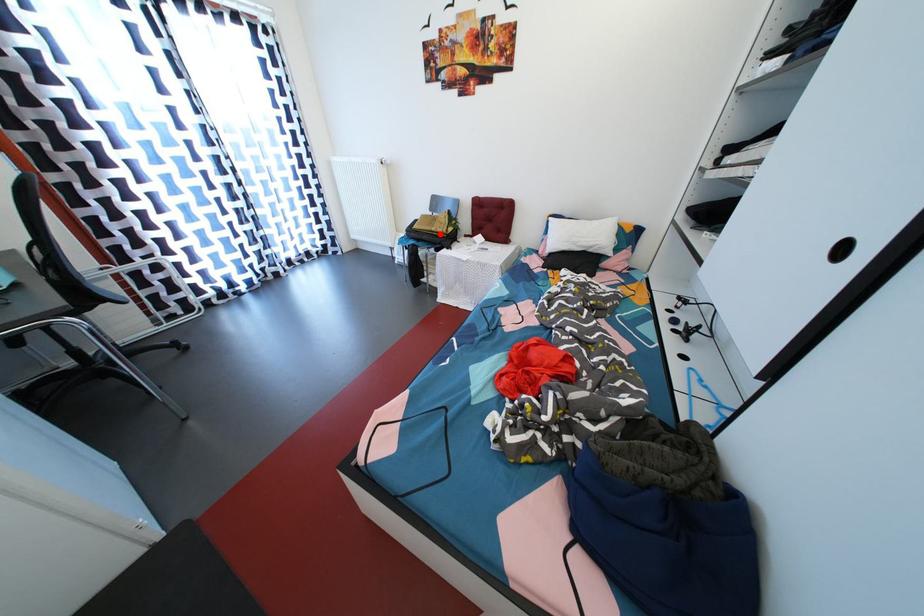
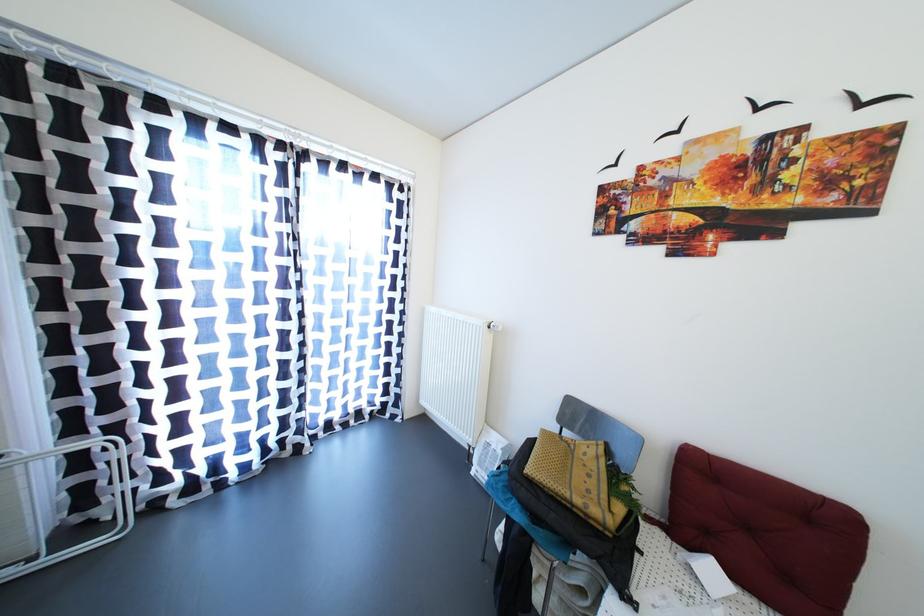
Locate, in the second image, the point that corresponds to the highlighted location in the first image.

(584, 506)